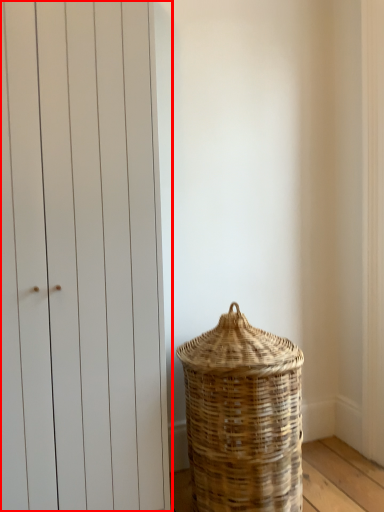
Question: From the image's perspective, where is door (annotated by the red box) located relative to basket?

Choices:
 (A) above
 (B) below

Answer: (A)